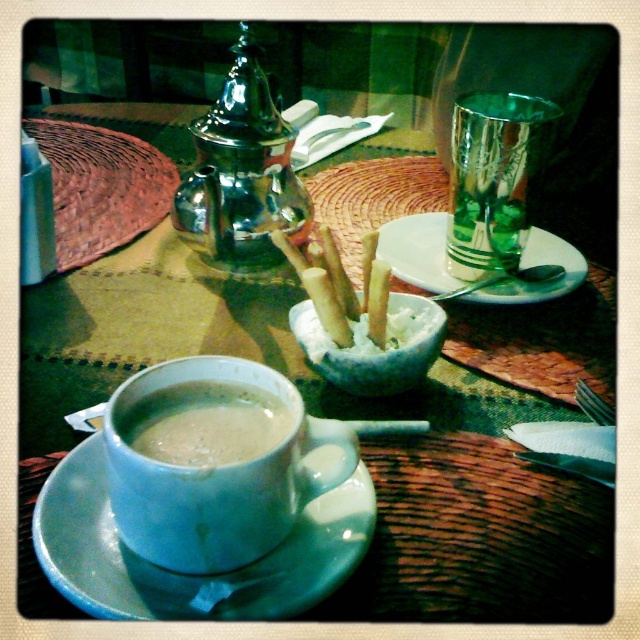
Question: Which object is positioned farthest from the transparent glass at upper right?

Choices:
 (A) white creamy sticks at center
 (B) white ceramic saucer at lower left

Answer: (B)

Question: Estimate the real-world distances between objects in this image. Which object is closer to the white creamy sticks at center?

Choices:
 (A) white matte mug at center
 (B) white ceramic saucer at lower left
 (C) white ceramic saucer at center
 (D) transparent glass at upper right

Answer: (A)

Question: Can you confirm if white glossy mug at center is positioned above white ceramic saucer at lower left?

Choices:
 (A) yes
 (B) no

Answer: (A)

Question: Is transparent glass at upper right closer to the viewer compared to white matte mug at center?

Choices:
 (A) no
 (B) yes

Answer: (A)

Question: Among these points, which one is farthest from the camera?

Choices:
 (A) 481,301
 (B) 276,568
 (C) 346,465
 (D) 385,317

Answer: (A)

Question: Does transparent glass at upper right have a lesser width compared to white matte mug at center?

Choices:
 (A) yes
 (B) no

Answer: (B)